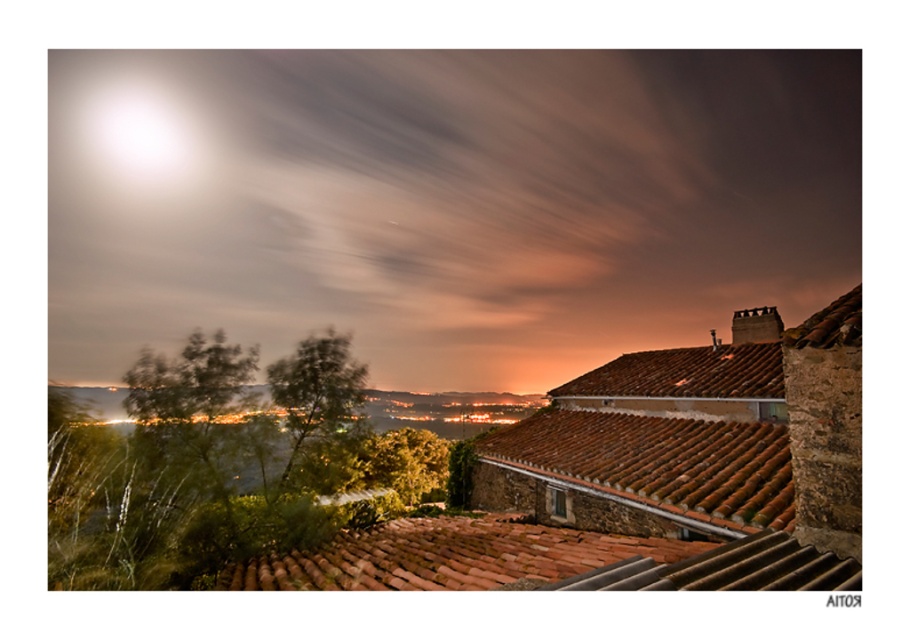
You are standing at the center of the rooftops in the village. You notice a point marked at coordinates (448, 556). What is the color of the surface where this point is located?

The point at (448, 556) is on reddish brown clay tiles at center.